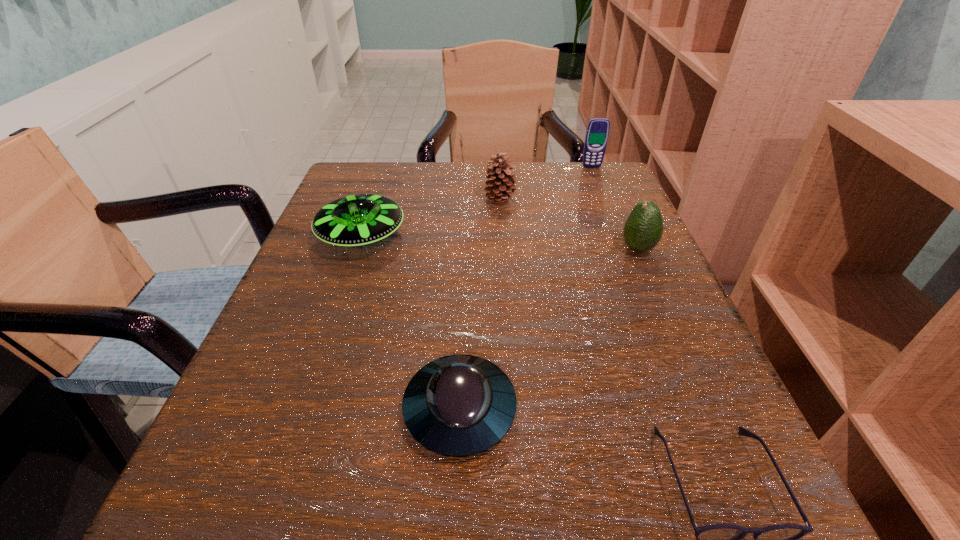
Identify the location of vacant area located 0.110m on the front of the farther saucer. (338, 308).

Where is `vacant area situated on the back of the shorter saucer`? The width and height of the screenshot is (960, 540). vacant area situated on the back of the shorter saucer is located at coordinates (465, 298).

At what (x,y) coordinates should I click in order to perform the action: click on cellular telephone that is at the far edge. Please return your answer as a coordinate pair (x, y). Image resolution: width=960 pixels, height=540 pixels. Looking at the image, I should click on (597, 132).

You are a GUI agent. You are given a task and a screenshot of the screen. Output one action in this format:
    pyautogui.click(x=<x>, y=<y>)
    Task: Click on the pinecone that is at the far edge
    The height and width of the screenshot is (540, 960).
    Given the screenshot: What is the action you would take?
    pyautogui.click(x=504, y=179)

Find the location of a particular element. The height and width of the screenshot is (540, 960). saucer that is at the far edge is located at coordinates (358, 220).

Locate an element on the screen. object present at the near edge is located at coordinates (460, 405).

Image resolution: width=960 pixels, height=540 pixels. I want to click on object at the left edge, so click(358, 220).

Locate an element on the screen. cellular telephone that is at the right edge is located at coordinates (597, 132).

The width and height of the screenshot is (960, 540). I want to click on avocado at the right edge, so click(643, 229).

You are a GUI agent. You are given a task and a screenshot of the screen. Output one action in this format:
    pyautogui.click(x=<x>, y=<y>)
    Task: Click on the object located at the far left corner
    
    Given the screenshot: What is the action you would take?
    pyautogui.click(x=358, y=220)